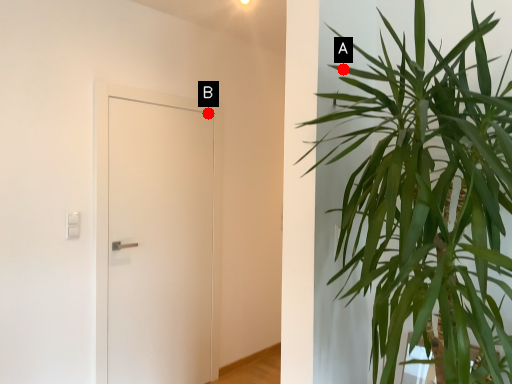
Question: Two points are circled on the image, labeled by A and B beside each circle. Which point is closer to the camera?

Choices:
 (A) A is closer
 (B) B is closer

Answer: (A)